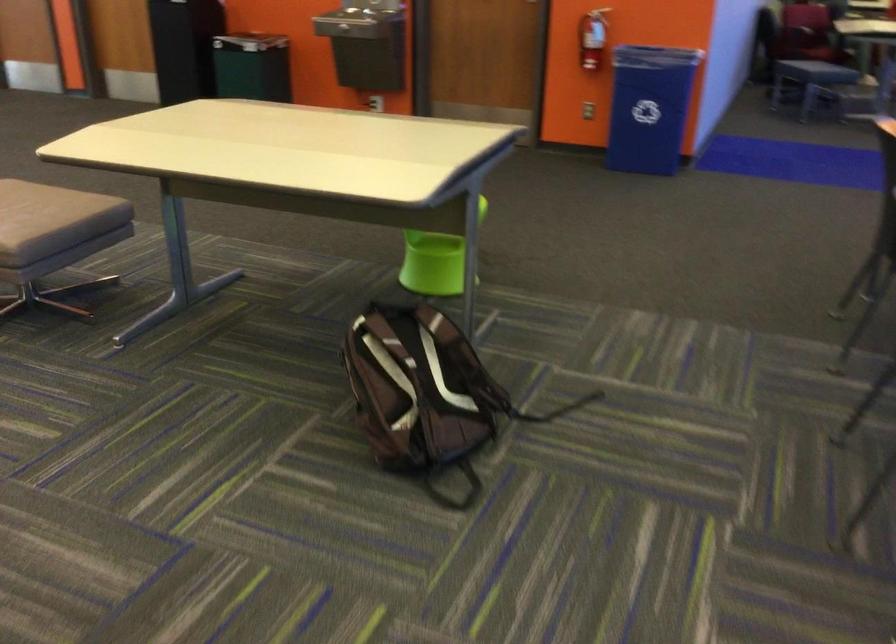
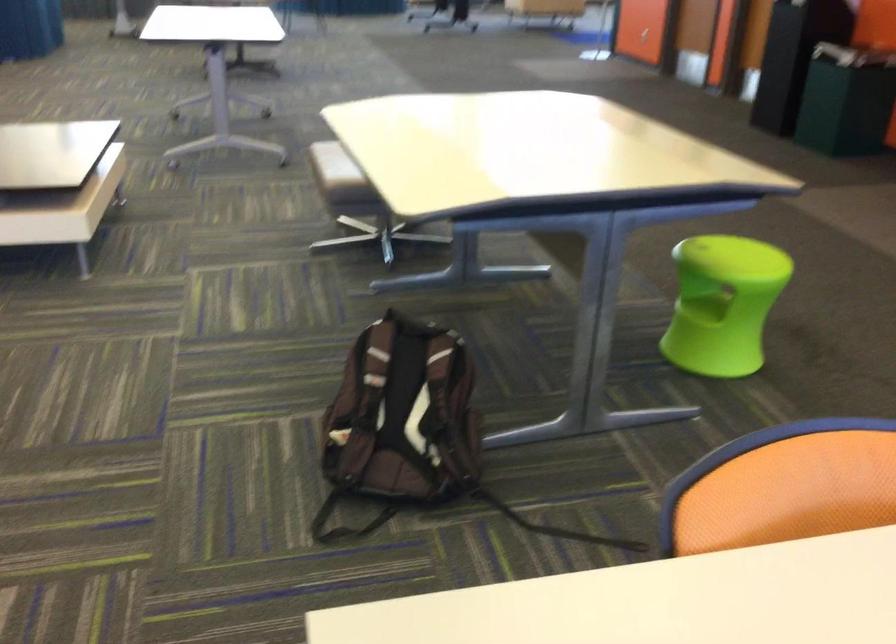
Question: I am providing you with two images of the same scene from different viewpoints. Which of the following objects are not visible in image2?

Choices:
 (A) white power outlet
 (B) gray sitting surface
 (C) orange chair sitting surface
 (D) brown backpack

Answer: (B)